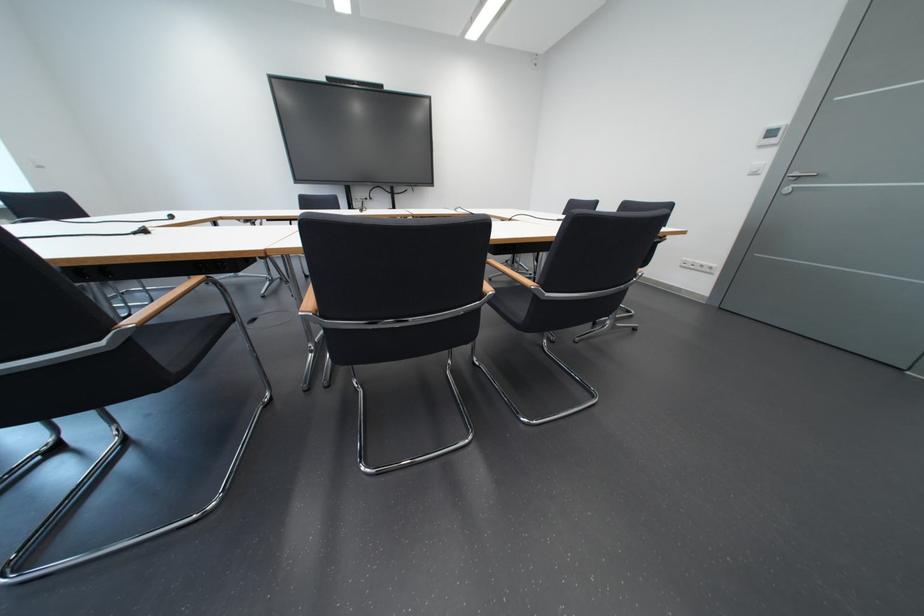
Where would you press the white light switch? Please return your answer as a coordinate pair (x, y).

(756, 168)